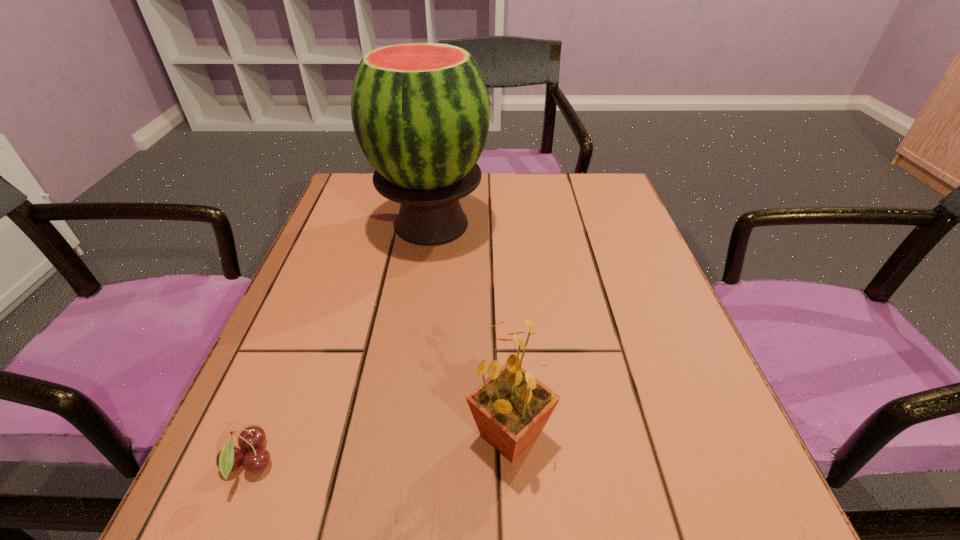
Where is `object at the far edge`? This screenshot has height=540, width=960. object at the far edge is located at coordinates (420, 111).

You are a GUI agent. You are given a task and a screenshot of the screen. Output one action in this format:
    pyautogui.click(x=<x>, y=<y>)
    Task: Click on the sunflower located at the near edge
    The height and width of the screenshot is (540, 960).
    Given the screenshot: What is the action you would take?
    pyautogui.click(x=511, y=407)

Find the location of `cherry at the near edge`. cherry at the near edge is located at coordinates (229, 459).

Where is `watermelon located in the left edge section of the desktop`? This screenshot has width=960, height=540. watermelon located in the left edge section of the desktop is located at coordinates (420, 111).

Locate an element on the screen. The height and width of the screenshot is (540, 960). cherry positioned at the left edge is located at coordinates (229, 459).

Where is `object at the far left corner`? The image size is (960, 540). object at the far left corner is located at coordinates (420, 111).

Locate an element on the screen. The height and width of the screenshot is (540, 960). object that is at the near left corner is located at coordinates (229, 459).

Locate an element on the screen. free space at the far edge is located at coordinates (534, 210).

Locate an element on the screen. The image size is (960, 540). vacant space at the near edge of the desktop is located at coordinates (462, 507).

This screenshot has width=960, height=540. I want to click on free space at the left edge of the desktop, so click(255, 413).